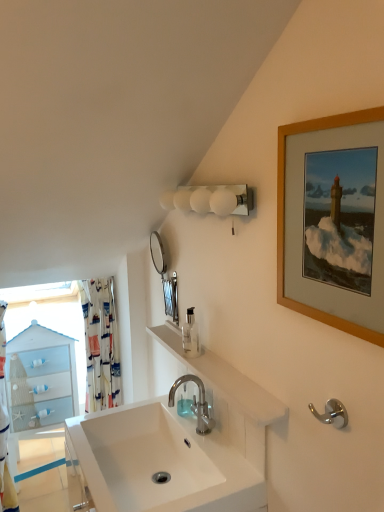
At what (x,y) coordinates should I click in order to perform the action: click on free space in front of clear plastic soap dispenser at center. Please return your answer as a coordinate pair (x, y). The width and height of the screenshot is (384, 512). Looking at the image, I should click on (216, 365).